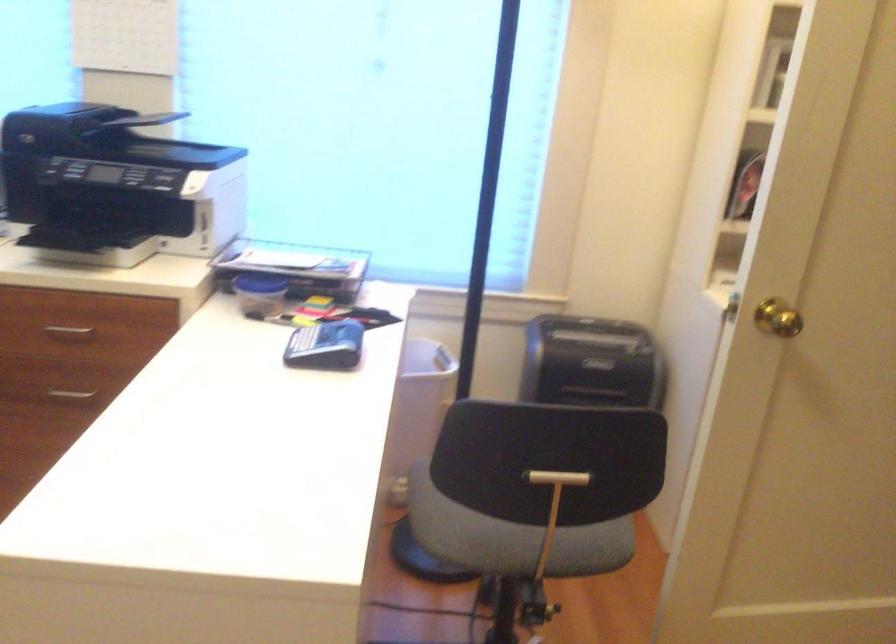
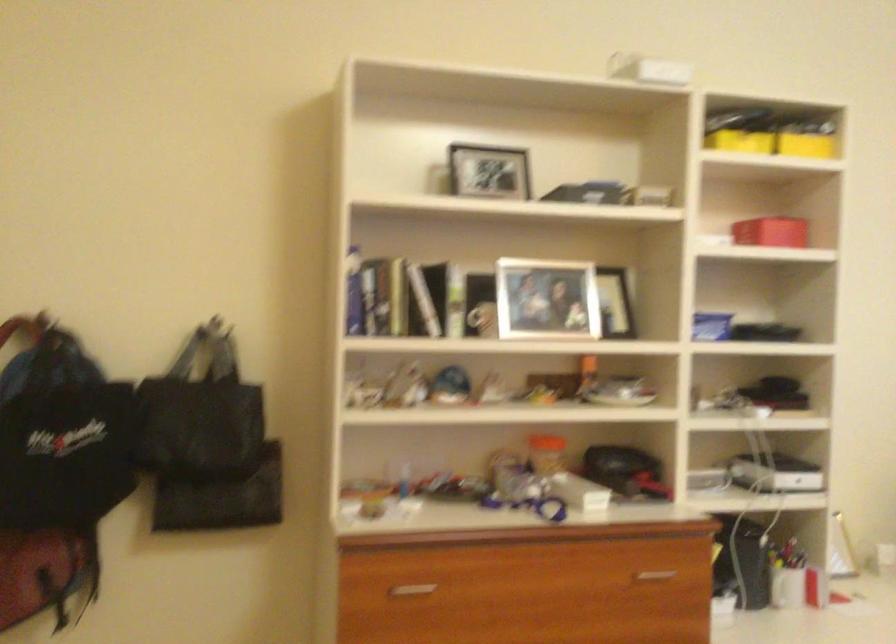
Question: The camera is either moving clockwise (left) or counter-clockwise (right) around the object. The first image is from the beginning of the video and the second image is from the end. Is the camera moving left or right when shooting the video?

Choices:
 (A) Left
 (B) Right

Answer: (B)